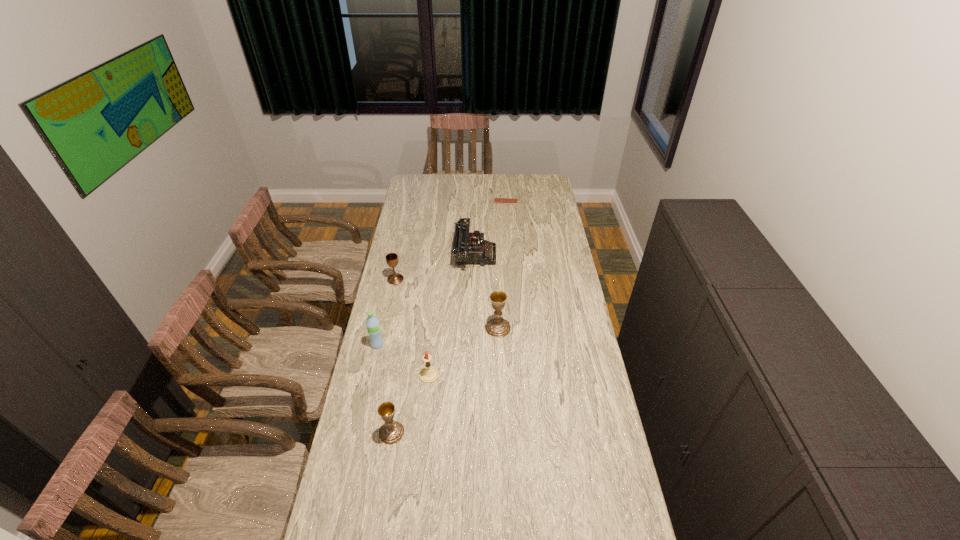
You are a GUI agent. You are given a task and a screenshot of the screen. Output one action in this format:
    pyautogui.click(x=<x>, y=<y>)
    Task: Click on the free space at the left edge
    The width and height of the screenshot is (960, 540).
    Given the screenshot: What is the action you would take?
    pyautogui.click(x=372, y=377)

The width and height of the screenshot is (960, 540). In order to click on vacant space at the right edge in this screenshot , I will do `click(576, 294)`.

Locate an element on the screen. vacant region at the far left corner of the desktop is located at coordinates (421, 190).

Locate an element on the screen. vacant region at the far right corner of the desktop is located at coordinates (542, 175).

At what (x,y) coordinates should I click in order to perform the action: click on free spot between the typewriter and the tallest chalice. Please return your answer as a coordinate pair (x, y). The width and height of the screenshot is (960, 540). Looking at the image, I should click on (486, 291).

Where is `free spot between the farthest object and the candle`? Image resolution: width=960 pixels, height=540 pixels. free spot between the farthest object and the candle is located at coordinates (468, 288).

Locate an element on the screen. The height and width of the screenshot is (540, 960). free space between the nearest object and the chocolate bar is located at coordinates (448, 317).

Identify the location of free spot between the second chalice from left to right and the candle. This screenshot has height=540, width=960. (410, 404).

Where is `unoccupied area between the shortest object and the typewriter`? The width and height of the screenshot is (960, 540). unoccupied area between the shortest object and the typewriter is located at coordinates (490, 228).

Where is `free space between the shortest object and the fourth farthest object`? Image resolution: width=960 pixels, height=540 pixels. free space between the shortest object and the fourth farthest object is located at coordinates (502, 265).